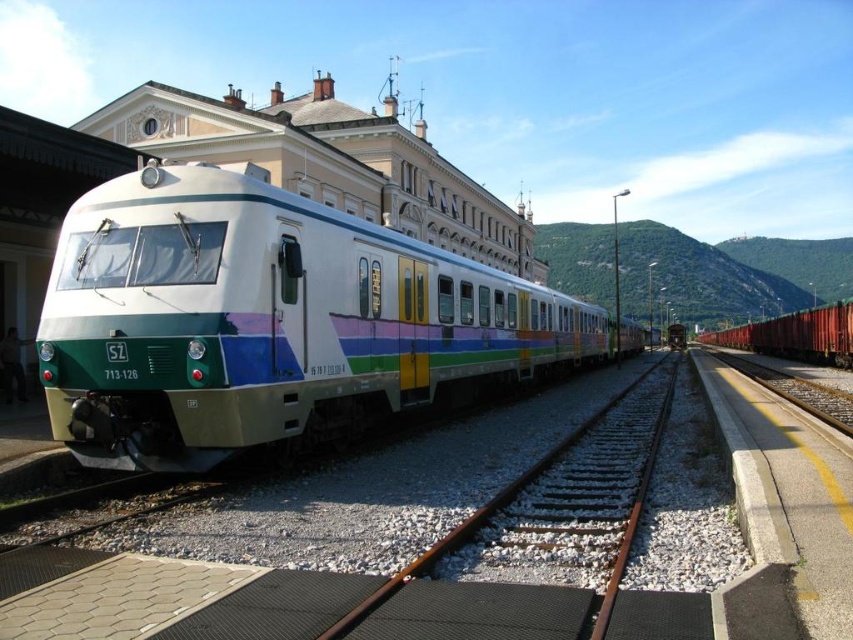
Does point (805, 314) come behind point (631, 384)?

Yes, it is behind point (631, 384).

Is point (782, 353) positioned in front of point (440, 548)?

No, it is not.

Identify the location of red matte freight car at right. (795, 336).

The width and height of the screenshot is (853, 640). Find the location of `white glossy passenger train at center`. white glossy passenger train at center is located at coordinates (x=267, y=321).

Does white glossy passenger train at center have a lesser width compared to brown metal train track at center?

Incorrect, white glossy passenger train at center's width is not less than brown metal train track at center's.

Between point (274, 241) and point (479, 515), which one is positioned behind?

The point (274, 241) is behind.

You are a GUI agent. You are given a task and a screenshot of the screen. Output one action in this format:
    pyautogui.click(x=<x>, y=<y>)
    Task: Click on the white glossy passenger train at center
    
    Given the screenshot: What is the action you would take?
    pyautogui.click(x=267, y=321)

Is point (114, 424) less distant than point (787, 330)?

Yes, it is in front of point (787, 330).

Which is more to the left, white glossy passenger train at center or red matte freight car at right?

From the viewer's perspective, white glossy passenger train at center appears more on the left side.

Where is `white glossy passenger train at center`? This screenshot has height=640, width=853. white glossy passenger train at center is located at coordinates (267, 321).